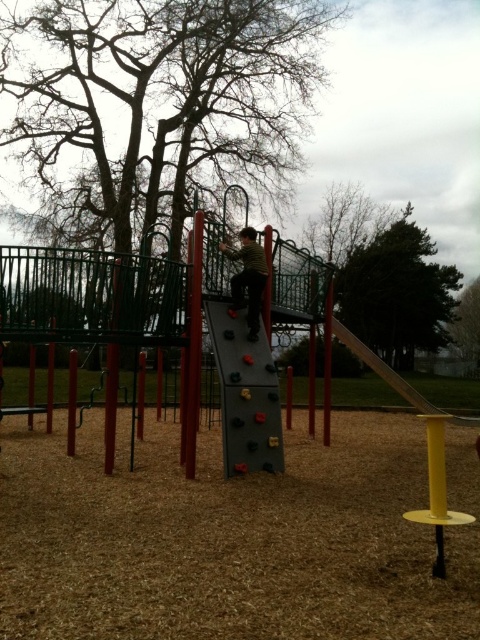
Which is above, smooth red pole at center or striped shirt at center?

striped shirt at center

From the picture: Is smooth red pole at center to the right of striped shirt at center from the viewer's perspective?

In fact, smooth red pole at center is to the left of striped shirt at center.

Find the location of a particular element. This screenshot has height=640, width=480. smooth red pole at center is located at coordinates (193, 342).

Looking at this image, between metallic silver slide at right and yellow metallic pole at right, which one has less height?

metallic silver slide at right is shorter.

Does metallic silver slide at right appear over yellow metallic pole at right?

No, metallic silver slide at right is not above yellow metallic pole at right.

The image size is (480, 640). What do you see at coordinates (395, 378) in the screenshot?
I see `metallic silver slide at right` at bounding box center [395, 378].

This screenshot has width=480, height=640. Identify the location of metallic silver slide at right. (395, 378).

Can you confirm if smooth red pole at center is positioned to the right of yellow metallic pole at right?

No, smooth red pole at center is not to the right of yellow metallic pole at right.

The width and height of the screenshot is (480, 640). Describe the element at coordinates (193, 342) in the screenshot. I see `smooth red pole at center` at that location.

Locate an element on the screen. The height and width of the screenshot is (640, 480). smooth red pole at center is located at coordinates (193, 342).

Locate an element on the screen. The height and width of the screenshot is (640, 480). smooth red pole at center is located at coordinates (193, 342).